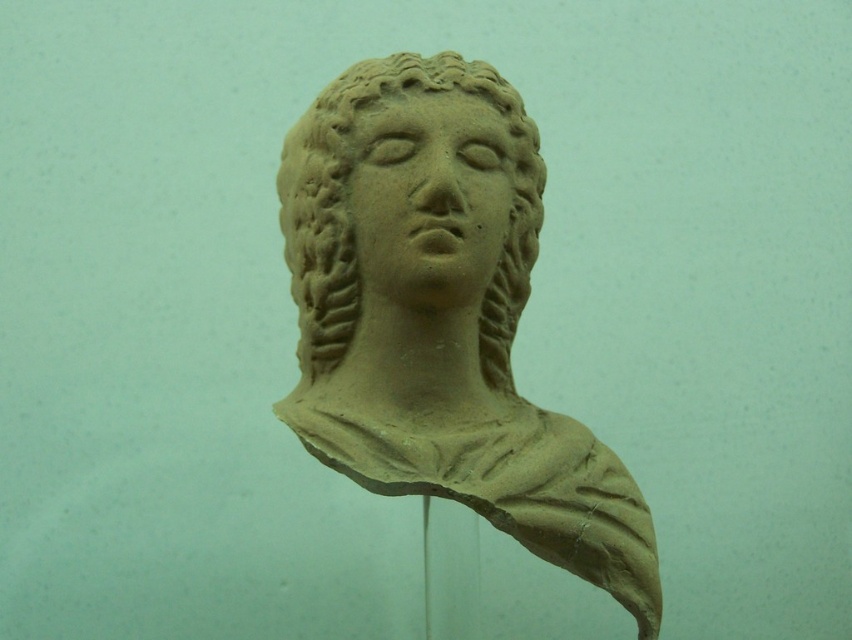
Who is more forward, (373,392) or (494,140)?

Point (373,392) is more forward.

Does matte clay bust at center have a larger size compared to matte clay face at center?

Yes, matte clay bust at center is bigger than matte clay face at center.

Which is in front, point (488, 396) or point (375, 244)?

Point (375, 244)

The height and width of the screenshot is (640, 852). I want to click on matte clay bust at center, so click(x=441, y=316).

Is matte clay bust at center positioned behind matte clay head at center?

No, it is in front of matte clay head at center.

Looking at this image, between matte clay bust at center and matte clay head at center, which one has more height?

Standing taller between the two is matte clay bust at center.

Between point (611, 593) and point (499, 324), which one is positioned behind?

The point (499, 324) is more distant.

Locate an element on the screen. This screenshot has width=852, height=640. matte clay bust at center is located at coordinates [x=441, y=316].

Which is above, matte clay head at center or matte clay face at center?

Positioned higher is matte clay face at center.

Who is positioned more to the left, matte clay head at center or matte clay face at center?

matte clay head at center is more to the left.

Describe the element at coordinates (348, 216) in the screenshot. I see `matte clay head at center` at that location.

Find the location of a particular element. This screenshot has height=640, width=852. matte clay head at center is located at coordinates (348, 216).